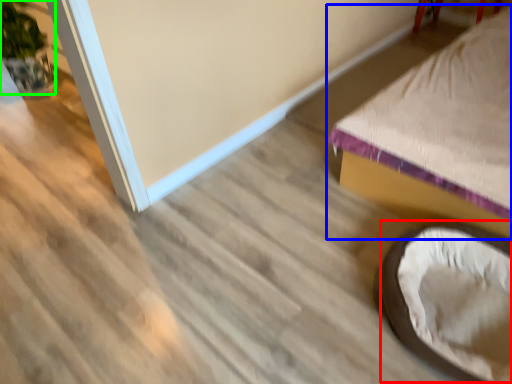
Question: Which is farther away from bean bag chair (highlighted by a red box)? furniture (highlighted by a blue box) or plant (highlighted by a green box)?

Choices:
 (A) furniture
 (B) plant

Answer: (B)